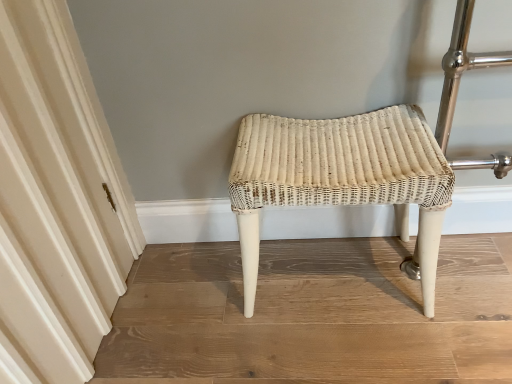
Where is `free point below white wicker stool at center (from a real-world perspective)`? The image size is (512, 384). free point below white wicker stool at center (from a real-world perspective) is located at coordinates (330, 273).